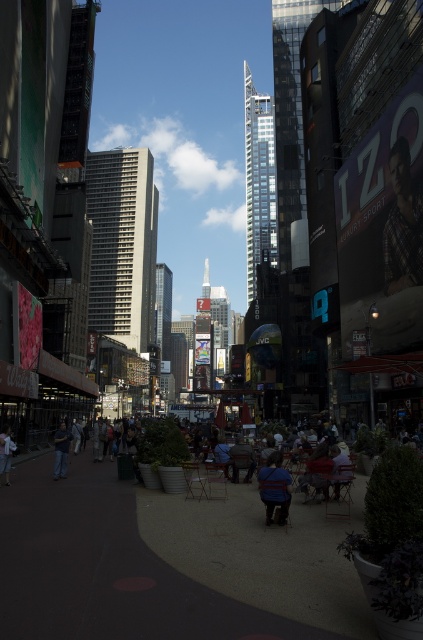
You are a photographer standing in the bustling urban scene of Times Square. You notice a person wearing a blue fabric shirt at center and light blue denim jeans at lower left. Which clothing item appears shorter in the image?

The blue fabric shirt at center has a lesser height compared to the light blue denim jeans at lower left, so the blue fabric shirt at center appears shorter.